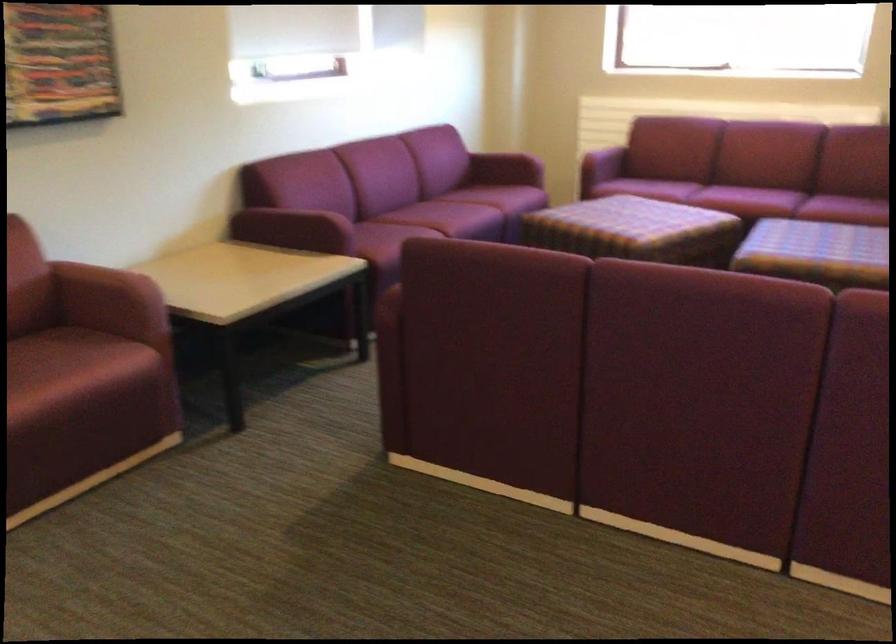
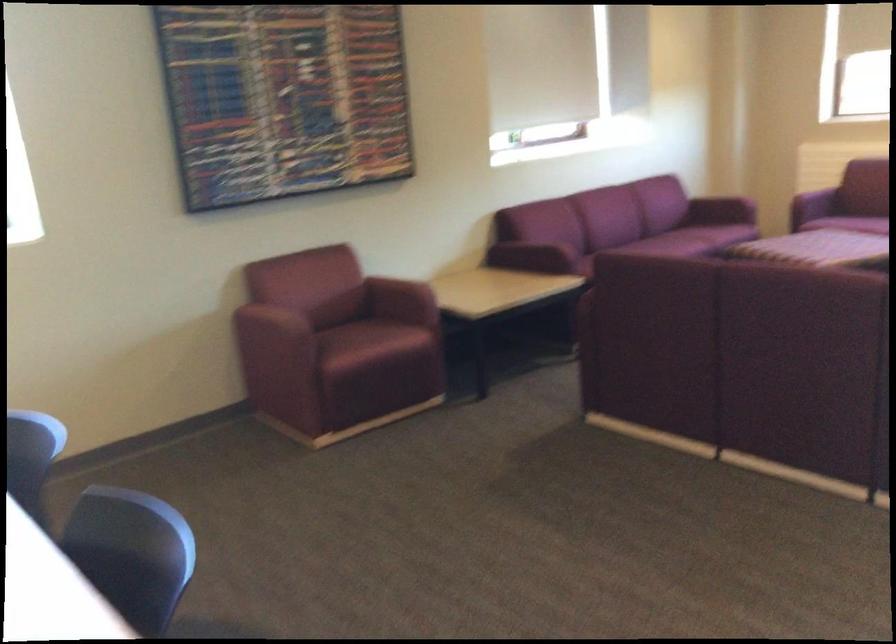
In the second image, find the point that corresponds to point (507, 166) in the first image.

(720, 211)